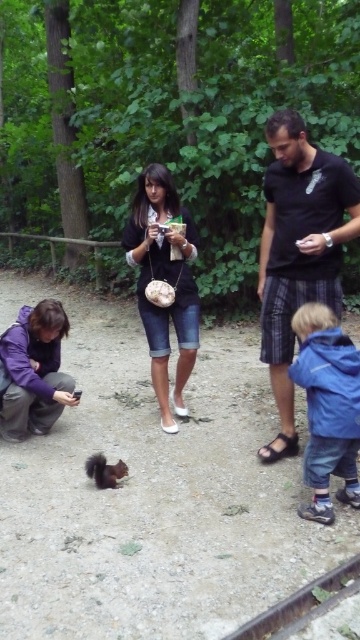
Does purple fabric jacket at lower left have a lesser height compared to shiny brown fur at lower left?

No, purple fabric jacket at lower left is not shorter than shiny brown fur at lower left.

Which is behind, point (41, 340) or point (86, 468)?

Point (41, 340)

Who is more forward, (42, 408) or (110, 465)?

Point (110, 465) is in front.

Find the location of a particular element. This screenshot has height=640, width=360. purple fabric jacket at lower left is located at coordinates (33, 371).

Does black cotton shirt at center have a greater width compared to shiny brown fur at lower left?

Correct, the width of black cotton shirt at center exceeds that of shiny brown fur at lower left.

Which is more to the left, black cotton shirt at center or shiny brown fur at lower left?

From the viewer's perspective, shiny brown fur at lower left appears more on the left side.

Locate an element on the screen. black cotton shirt at center is located at coordinates (299, 252).

This screenshot has width=360, height=640. In order to click on black cotton shirt at center in this screenshot , I will do `click(299, 252)`.

Who is more distant from viewer, (132, 212) or (104, 468)?

Point (132, 212)

Does denim shorts at center appear under shiny brown fur at lower left?

No, denim shorts at center is not below shiny brown fur at lower left.

Image resolution: width=360 pixels, height=640 pixels. Describe the element at coordinates (164, 280) in the screenshot. I see `denim shorts at center` at that location.

I want to click on denim shorts at center, so click(x=164, y=280).